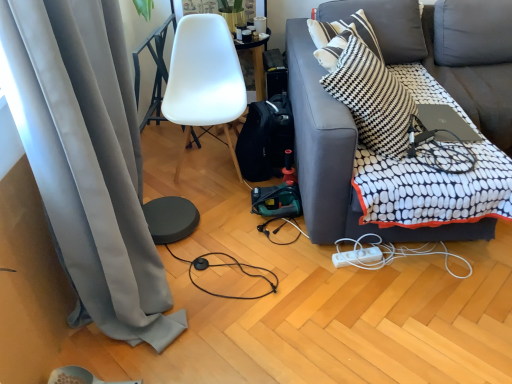
Locate an element on the screen. free point to the right of white plastic power outlet at lower center is located at coordinates (392, 262).